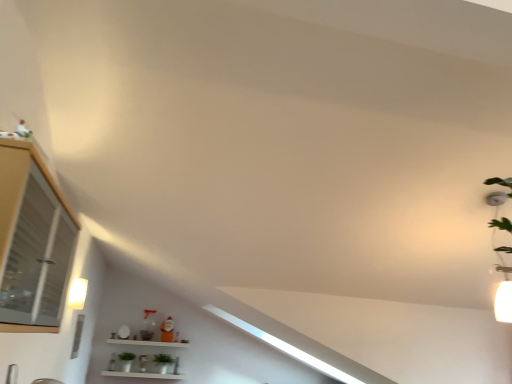
Question: Is white glossy shelf at lower center bigger or smaller than matte white light fixture at left?

Choices:
 (A) small
 (B) big

Answer: (B)

Question: From a real-world perspective, is white glossy shelf at lower center positioned above or below matte white light fixture at left?

Choices:
 (A) below
 (B) above

Answer: (A)

Question: Which object is the closest to the matte white light fixture at left?

Choices:
 (A) green matte plant at lower center
 (B) white glossy shelf at lower center
 (C) matte glass cabinet at left

Answer: (C)

Question: Estimate the real-world distances between objects in this image. Which object is farther from the white glossy shelf at lower center?

Choices:
 (A) green matte plant at lower center
 (B) matte glass cabinet at left
 (C) matte white light fixture at left

Answer: (B)